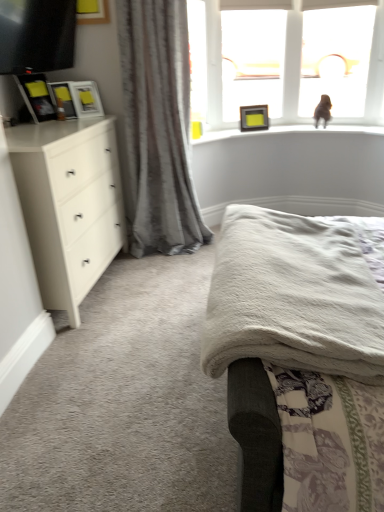
Locate an element on the screen. white soft bed at upper center is located at coordinates (306, 348).

What are the coordinates of `matte black tv at upper left` in the screenshot? It's located at (36, 35).

You are a GUI agent. You are given a task and a screenshot of the screen. Output one action in this format:
    pyautogui.click(x=<x>, y=<y>)
    Task: Click on the white matte chest of drawers at left
    The height and width of the screenshot is (512, 384).
    Given the screenshot: What is the action you would take?
    pyautogui.click(x=69, y=205)

The width and height of the screenshot is (384, 512). I want to click on transparent glass window at upper right, placed as the first window screen when sorted from right to left, so click(336, 59).

Is transparent glass window at upper right, the 2th window screen positioned from the left, positioned behind white matte chest of drawers at left?

Yes, it is.

From the image's perspective, which is below, transparent glass window at upper right, the 2th window screen positioned from the left, or white matte chest of drawers at left?

white matte chest of drawers at left.

From a real-world perspective, who is located higher, transparent glass window at upper right, placed as the first window screen when sorted from right to left, or white matte chest of drawers at left?

transparent glass window at upper right, placed as the first window screen when sorted from right to left.

Between transparent glass window at upper right, placed as the first window screen when sorted from right to left, and white matte chest of drawers at left, which one has larger width?

white matte chest of drawers at left is wider.

Does white matte chest of drawers at left turn towards white soft bed at upper center?

Yes, white matte chest of drawers at left is facing white soft bed at upper center.

From the image's perspective, which object appears higher, white matte chest of drawers at left or white soft bed at upper center?

white matte chest of drawers at left appears higher in the image.

Which is more to the left, white matte chest of drawers at left or white soft bed at upper center?

From the viewer's perspective, white matte chest of drawers at left appears more on the left side.

Is white soft bed at upper center surrounded by white matte chest of drawers at left?

No, white soft bed at upper center is not inside white matte chest of drawers at left.

From a real-world perspective, who is located higher, matte black picture frame at upper center, the 1th picture frame from the right, or gray textured curtain at left?

From a 3D spatial view, matte black picture frame at upper center, the 1th picture frame from the right, is above.

Which of these two, matte black picture frame at upper center, the 1th picture frame from the right, or gray textured curtain at left, is thinner?

matte black picture frame at upper center, the 1th picture frame from the right, is thinner.

Does matte black picture frame at upper center, the 1th picture frame from the right, have a greater height compared to gray textured curtain at left?

No, matte black picture frame at upper center, the 1th picture frame from the right, is not taller than gray textured curtain at left.

Would you consider matte black picture frame at upper center, which is counted as the fourth picture frame, starting from the front, to be distant from gray textured curtain at left?

They are positioned close to each other.

Is point (37, 198) less distant than point (92, 109)?

Yes, it is.

Considering the positions of objects white matte chest of drawers at left and matte white picture frame at upper left, marked as the third picture frame in a left-to-right arrangement, in the image provided, who is behind, white matte chest of drawers at left or matte white picture frame at upper left, marked as the third picture frame in a left-to-right arrangement,?

matte white picture frame at upper left, marked as the third picture frame in a left-to-right arrangement, is more distant.

From a real-world perspective, is white matte chest of drawers at left positioned above or below matte white picture frame at upper left, the second picture frame from the right?

Clearly, from a real-world perspective, white matte chest of drawers at left is below matte white picture frame at upper left, the second picture frame from the right.

Measure the distance between white matte chest of drawers at left and matte white picture frame at upper left, the second picture frame from the right.

A distance of 67.63 centimeters exists between white matte chest of drawers at left and matte white picture frame at upper left, the second picture frame from the right.

Is the surface of matte black tv at upper left in direct contact with matte black picture frame at upper center, which is counted as the fourth picture frame, starting from the front?

matte black tv at upper left is not next to matte black picture frame at upper center, which is counted as the fourth picture frame, starting from the front, and they're not touching.

Consider the image. Which of these two, matte black tv at upper left or matte black picture frame at upper center, acting as the 4th picture frame starting from the left, is bigger?

With larger size is matte black tv at upper left.

Does matte black tv at upper left have a greater height compared to matte black picture frame at upper center, the 1th picture frame from the right?

Yes.

Do you think matte black tv at upper left is within matte black picture frame at upper center, the 1th picture frame from the right, or outside of it?

matte black tv at upper left is outside matte black picture frame at upper center, the 1th picture frame from the right.

At what (x,y) coordinates should I click in order to perform the action: click on picture frame that is the 1st one when counting backward from the matte black picture frame at left, which is the third picture frame in back-to-front order. Please return your answer as a coordinate pair (x, y). Looking at the image, I should click on (86, 99).

From the image's perspective, is matte white picture frame at upper left, which is the second picture frame from back to front, over matte black picture frame at left, which ranks as the 2th picture frame in front-to-back order?

Yes.

Is matte white picture frame at upper left, marked as the third picture frame in a left-to-right arrangement, touching matte black picture frame at left, positioned as the third picture frame in right-to-left order?

Yes, matte white picture frame at upper left, marked as the third picture frame in a left-to-right arrangement, is with matte black picture frame at left, positioned as the third picture frame in right-to-left order.

Who is bigger, transparent plastic frame at upper center, the 2th window screen when ordered from right to left, or matte black picture frame at upper center, acting as the 4th picture frame starting from the left?

transparent plastic frame at upper center, the 2th window screen when ordered from right to left, is bigger.

Which object is positioned more to the right, transparent plastic frame at upper center, acting as the first window screen starting from the left, or matte black picture frame at upper center, which is counted as the fourth picture frame, starting from the front?

Positioned to the right is matte black picture frame at upper center, which is counted as the fourth picture frame, starting from the front.

Is transparent plastic frame at upper center, the 2th window screen when ordered from right to left, shorter than matte black picture frame at upper center, the 1th picture frame from the right?

No, transparent plastic frame at upper center, the 2th window screen when ordered from right to left, is not shorter than matte black picture frame at upper center, the 1th picture frame from the right.

Is point (245, 61) in front of point (263, 113)?

That is True.

This screenshot has height=512, width=384. I want to click on the chest of drawers that appears below the transparent glass window at upper right, placed as the first window screen when sorted from right to left (from a real-world perspective), so click(69, 205).

You are a GUI agent. You are given a task and a screenshot of the screen. Output one action in this format:
    pyautogui.click(x=<x>, y=<y>)
    Task: Click on the chest of drawers on the left of white soft bed at upper center
    The image size is (384, 512).
    Given the screenshot: What is the action you would take?
    pyautogui.click(x=69, y=205)

Which object lies further to the anchor point transparent plastic frame at upper center, the 2th window screen when ordered from right to left, matte black tv at upper left or white soft bed at upper center?

The object further to transparent plastic frame at upper center, the 2th window screen when ordered from right to left, is white soft bed at upper center.

When comparing their distances from white matte chest of drawers at left, does matte black picture frame at left, placed as the first picture frame when sorted from left to right, or white soft bed at upper center seem closer?

The object closer to white matte chest of drawers at left is matte black picture frame at left, placed as the first picture frame when sorted from left to right.

From the image, which object appears to be farther from matte black picture frame at upper center, which is counted as the fourth picture frame, starting from the front, matte black picture frame at left, the 1th picture frame viewed from the front, or gray textured curtain at left?

The object further to matte black picture frame at upper center, which is counted as the fourth picture frame, starting from the front, is matte black picture frame at left, the 1th picture frame viewed from the front.

Based on their spatial positions, is matte black tv at upper left or white soft bed at upper center further from matte black picture frame at left, arranged as the fourth picture frame when viewed from the back?

The object further to matte black picture frame at left, arranged as the fourth picture frame when viewed from the back, is white soft bed at upper center.

Based on their spatial positions, is matte black picture frame at left, which is the third picture frame in back-to-front order, or matte white picture frame at upper left, marked as the third picture frame in a left-to-right arrangement, closer to matte black picture frame at left, placed as the first picture frame when sorted from left to right?

matte black picture frame at left, which is the third picture frame in back-to-front order.

Considering their positions, is matte black picture frame at left, which is the 2th picture frame in left-to-right order, positioned closer to transparent glass window at upper right, placed as the first window screen when sorted from right to left, than gray textured curtain at left?

gray textured curtain at left.

When comparing their distances from gray textured curtain at left, does matte white picture frame at upper left, arranged as the 3th picture frame when viewed from the front, or transparent glass window at upper right, the 2th window screen positioned from the left, seem closer?

matte white picture frame at upper left, arranged as the 3th picture frame when viewed from the front, is positioned closer to the anchor gray textured curtain at left.

Looking at the image, which one is located closer to matte white picture frame at upper left, arranged as the 3th picture frame when viewed from the front, white matte chest of drawers at left or matte black picture frame at left, placed as the first picture frame when sorted from left to right?

matte black picture frame at left, placed as the first picture frame when sorted from left to right, lies closer to matte white picture frame at upper left, arranged as the 3th picture frame when viewed from the front, than the other object.

This screenshot has height=512, width=384. What are the coordinates of `window screen located between matte white picture frame at upper left, which is the second picture frame from back to front, and matte black picture frame at upper center, the 1th picture frame from the right, in the left-right direction` in the screenshot? It's located at (252, 60).

Identify the location of curtain located between white soft bed at upper center and transparent glass window at upper right, placed as the first window screen when sorted from right to left, in the depth direction. This screenshot has height=512, width=384. click(159, 126).

Where is `television between white matte chest of drawers at left and matte black picture frame at upper center, which is the 1th picture frame from back to front, in the front-back direction`? television between white matte chest of drawers at left and matte black picture frame at upper center, which is the 1th picture frame from back to front, in the front-back direction is located at coordinates (36, 35).

This screenshot has width=384, height=512. Find the location of `picture frame positioned between matte black tv at upper left and matte black picture frame at left, which ranks as the 2th picture frame in front-to-back order, from near to far`. picture frame positioned between matte black tv at upper left and matte black picture frame at left, which ranks as the 2th picture frame in front-to-back order, from near to far is located at coordinates (36, 96).